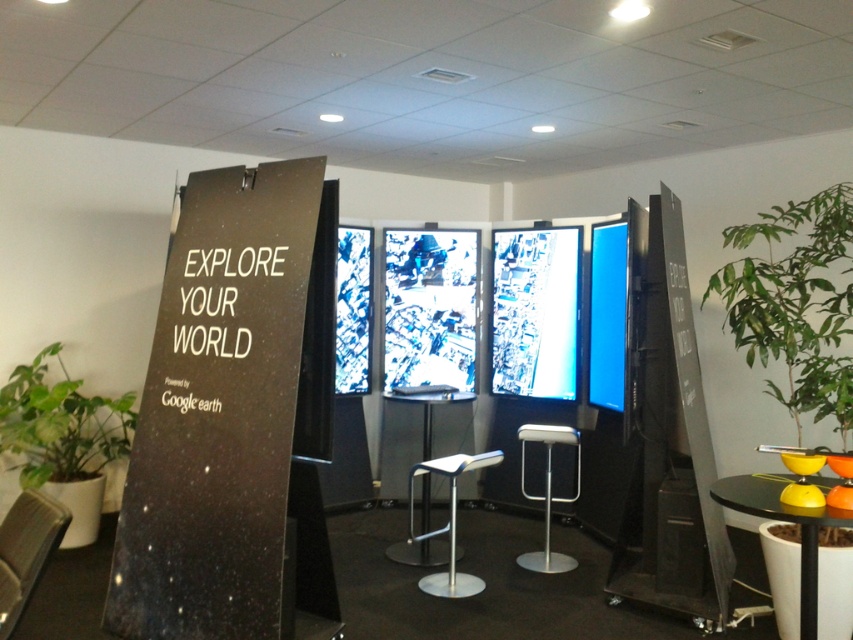
Question: Estimate the real-world distances between objects in this image. Which object is farther from the metallic silver table at center?

Choices:
 (A) green leafy plant at right
 (B) black glossy signboard at left
 (C) matte gray chair at lower left

Answer: (C)

Question: Is green leafy plant at right to the left of matte gray chair at lower left from the viewer's perspective?

Choices:
 (A) yes
 (B) no

Answer: (B)

Question: Considering the real-world distances, which object is farthest from the green leafy plant at lower left?

Choices:
 (A) black glossy signboard at left
 (B) black glossy table at lower right
 (C) silver metallic bar stool at center

Answer: (B)

Question: Which is nearer to the silver metallic bar stool at center?

Choices:
 (A) black glossy signboard at left
 (B) white plastic bar stool at center

Answer: (B)

Question: Does black glossy signboard at left appear under silver metallic bar stool at center?

Choices:
 (A) yes
 (B) no

Answer: (B)

Question: Does metallic silver table at center come in front of silver metallic bar stool at center?

Choices:
 (A) no
 (B) yes

Answer: (A)